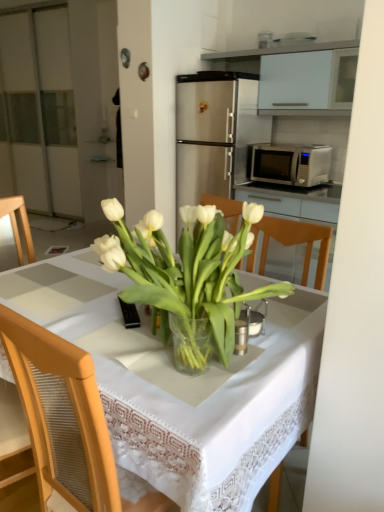
Measure the distance between black plastic remote control at center and camera.

The distance of black plastic remote control at center from camera is 1.23 meters.

Find the location of a particular element. white glossy cabinet at upper center is located at coordinates (299, 76).

I want to click on white glass vase at center, so click(x=186, y=267).

Find the location of a particular element. transparent glass vase at center is located at coordinates (173, 395).

Which of these two, satin silver microwave at center right or white glossy cabinet at upper center, stands shorter?

satin silver microwave at center right.

Is satin silver microwave at center right not near white glossy cabinet at upper center?

No, there isn't a large distance between satin silver microwave at center right and white glossy cabinet at upper center.

Considering the points (320, 173) and (312, 99), which point is behind, point (320, 173) or point (312, 99)?

Point (320, 173)

Are transparent glass vase at center and white glass vase at center far apart?

No, there isn't a large distance between transparent glass vase at center and white glass vase at center.

Is transparent glass vase at center inside the boundaries of white glass vase at center, or outside?

transparent glass vase at center is outside white glass vase at center.

Is point (288, 316) farther from camera compared to point (192, 217)?

Yes, point (288, 316) is behind point (192, 217).

From the image's perspective, is transparent glass vase at center over white glass vase at center?

No, from the image's perspective, transparent glass vase at center is not over white glass vase at center.

Is black plastic remote control at center wider than satin silver microwave at center right?

No.

Are black plastic remote control at center and satin silver microwave at center right making contact?

They are not placed beside each other.

This screenshot has height=512, width=384. I want to click on corded phone below the satin silver microwave at center right (from the image's perspective), so pyautogui.click(x=129, y=314).

From a real-world perspective, who is located lower, black plastic remote control at center or satin silver microwave at center right?

In real-world perspective, black plastic remote control at center is lower.

Consider the image. From the image's perspective, does satin silver microwave at center right appear lower than black plastic remote control at center?

No, from the image's perspective, satin silver microwave at center right is not beneath black plastic remote control at center.

Can you tell me how much satin silver microwave at center right and black plastic remote control at center differ in facing direction?

The angle between the facing direction of satin silver microwave at center right and the facing direction of black plastic remote control at center is 56.5 degrees.

Is satin silver microwave at center right to the right of black plastic remote control at center from the viewer's perspective?

Indeed, satin silver microwave at center right is positioned on the right side of black plastic remote control at center.

Which is farther, [298,161] or [137,316]?

The point [298,161] is farther from the camera.

Based on their sizes in the image, would you say white glossy cabinet at upper center is bigger or smaller than white glass vase at center?

white glossy cabinet at upper center is bigger than white glass vase at center.

Is white glossy cabinet at upper center at the left side of white glass vase at center?

No, white glossy cabinet at upper center is not to the left of white glass vase at center.

What's the angular difference between white glass vase at center and satin silver microwave at center right's facing directions?

87 degrees.

Considering the positions of points (112, 264) and (280, 161), is point (112, 264) closer to camera compared to point (280, 161)?

That is True.

Which of these two, white glass vase at center or satin silver microwave at center right, is bigger?

white glass vase at center.

Is white glass vase at center looking in the opposite direction of satin silver microwave at center right?

No, satin silver microwave at center right is not at the back of white glass vase at center.

Can you see transparent glass vase at center touching white glossy cabinet at upper center?

No, transparent glass vase at center is not touching white glossy cabinet at upper center.

Based on the photo, is transparent glass vase at center closer to the viewer compared to white glossy cabinet at upper center?

That is True.

Considering the positions of point (128, 390) and point (315, 45), is point (128, 390) closer or farther from the camera than point (315, 45)?

Point (128, 390) is closer to the camera than point (315, 45).

Does transparent glass vase at center have a greater width compared to white glossy cabinet at upper center?

Yes.

The height and width of the screenshot is (512, 384). I want to click on cabinetry located on the left of satin silver microwave at center right, so click(299, 76).

I want to click on flower behind the transparent glass vase at center, so click(186, 267).

Looking at the image, which one is located further to white glossy cabinet at upper center, black plastic remote control at center or transparent glass vase at center?

Based on the image, black plastic remote control at center appears to be further to white glossy cabinet at upper center.

Looking at this image, from the image, which object appears to be farther from black plastic remote control at center, satin silver microwave at center right or transparent glass vase at center?

The object further to black plastic remote control at center is satin silver microwave at center right.

Considering their positions, is satin silver microwave at center right positioned closer to white glass vase at center than white glossy cabinet at upper center?

The object closer to white glass vase at center is satin silver microwave at center right.

From the image, which object appears to be farther from black plastic remote control at center, white glass vase at center or satin silver microwave at center right?

The object further to black plastic remote control at center is satin silver microwave at center right.

Considering their positions, is white glass vase at center positioned further to transparent glass vase at center than satin silver microwave at center right?

The object further to transparent glass vase at center is satin silver microwave at center right.

Based on their spatial positions, is white glossy cabinet at upper center or white glass vase at center closer to transparent glass vase at center?

white glass vase at center is positioned closer to the anchor transparent glass vase at center.

Looking at the image, which one is located closer to black plastic remote control at center, white glass vase at center or transparent glass vase at center?

Among the two, white glass vase at center is located nearer to black plastic remote control at center.

Estimate the real-world distances between objects in this image. Which object is further from white glossy cabinet at upper center, satin silver microwave at center right or white glass vase at center?

white glass vase at center is further to white glossy cabinet at upper center.

At what (x,y) coordinates should I click in order to perform the action: click on corded phone between white glass vase at center and satin silver microwave at center right from front to back. Please return your answer as a coordinate pair (x, y). Image resolution: width=384 pixels, height=512 pixels. Looking at the image, I should click on (129, 314).

At what (x,y) coordinates should I click in order to perform the action: click on cabinetry located between black plastic remote control at center and satin silver microwave at center right in the depth direction. Please return your answer as a coordinate pair (x, y). The image size is (384, 512). Looking at the image, I should click on (299, 76).

Where is `corded phone located between transparent glass vase at center and white glossy cabinet at upper center in the depth direction`? corded phone located between transparent glass vase at center and white glossy cabinet at upper center in the depth direction is located at coordinates (129, 314).

Image resolution: width=384 pixels, height=512 pixels. In order to click on cabinetry between white glass vase at center and satin silver microwave at center right from front to back in this screenshot , I will do `click(299, 76)`.